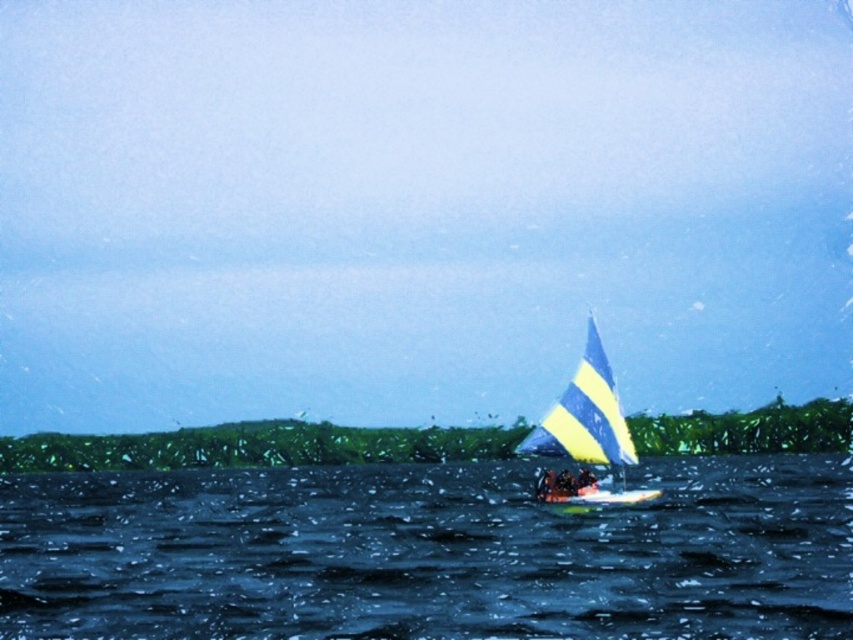
Question: Which point appears farthest from the camera in this image?

Choices:
 (A) (578, 480)
 (B) (576, 381)
 (C) (846, 481)

Answer: (C)

Question: In this image, where is yellow striped sailboat at center located relative to smooth skin person at center?

Choices:
 (A) left
 (B) right

Answer: (B)

Question: Is yellow striped sailboat at center smaller than yellow fabric sailboat at center?

Choices:
 (A) no
 (B) yes

Answer: (A)

Question: Can you confirm if yellow striped sailboat at center is positioned to the right of yellow fabric sailboat at center?

Choices:
 (A) no
 (B) yes

Answer: (B)

Question: Which of the following is the farthest from the observer?

Choices:
 (A) pyautogui.click(x=556, y=474)
 (B) pyautogui.click(x=450, y=620)
 (C) pyautogui.click(x=537, y=429)

Answer: (C)

Question: Which point is closer to the camera?

Choices:
 (A) yellow fabric sailboat at center
 (B) dark blue water at center

Answer: (B)